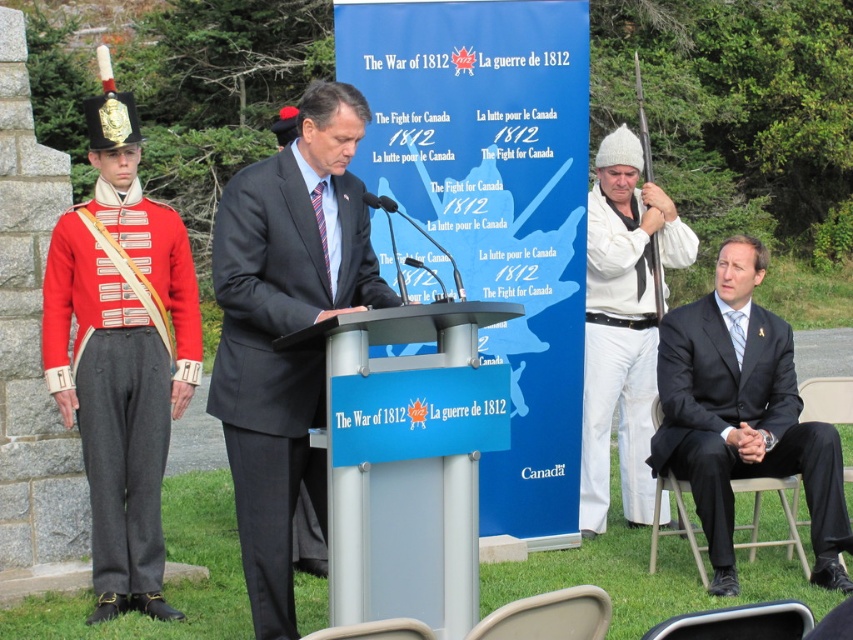
Question: Among these points, which one is farthest from the camera?

Choices:
 (A) (683, 429)
 (B) (370, 362)
 (C) (238, 464)

Answer: (A)

Question: Which is farther from the metallic silver podium at center?

Choices:
 (A) black suit at right
 (B) dark gray suit at center
 (C) red wool uniform at left

Answer: (A)

Question: Is the position of metallic silver podium at center less distant than that of white woolen hat at right?

Choices:
 (A) no
 (B) yes

Answer: (B)

Question: Observing the image, what is the correct spatial positioning of dark gray suit at center in reference to metallic silver podium at center?

Choices:
 (A) below
 (B) above

Answer: (B)

Question: Which object is closer to the camera taking this photo?

Choices:
 (A) dark gray suit at center
 (B) black suit at right
 (C) metallic silver podium at center
 (D) white woolen hat at right

Answer: (C)

Question: Is the position of metallic silver podium at center less distant than that of black suit at right?

Choices:
 (A) yes
 (B) no

Answer: (A)